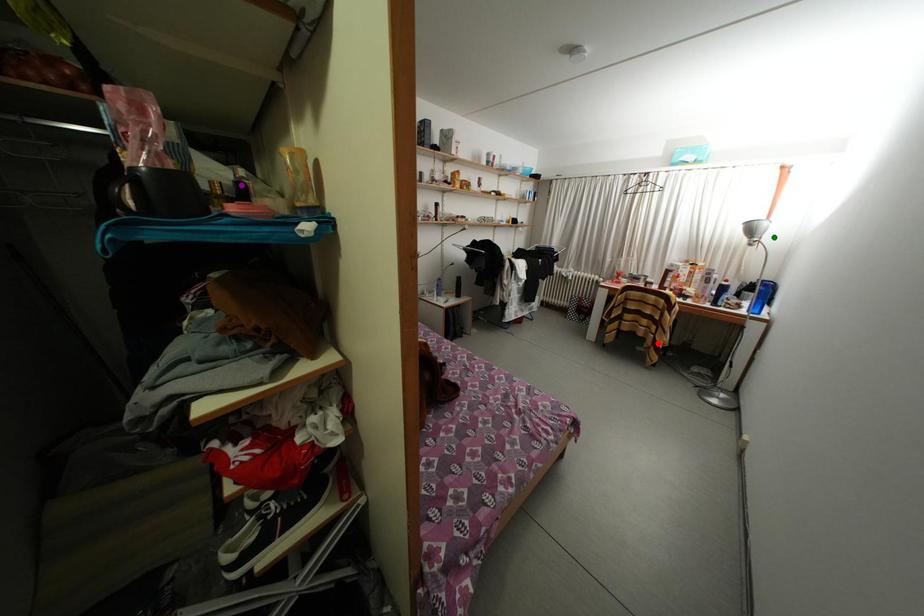
Order these from nearest to farthest:
green point | purple point | red point

1. red point
2. green point
3. purple point